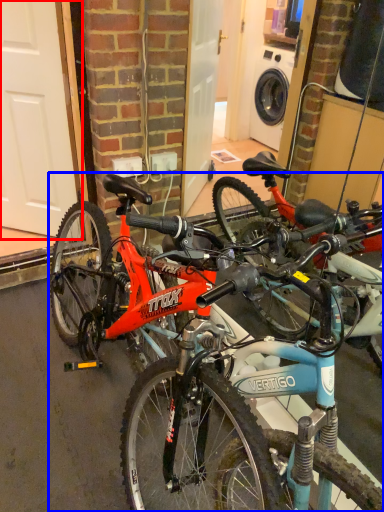
Question: Which object appears closest to the camera in this image, garage door (highlighted by a red box) or bicycle (highlighted by a blue box)?

Choices:
 (A) garage door
 (B) bicycle

Answer: (B)